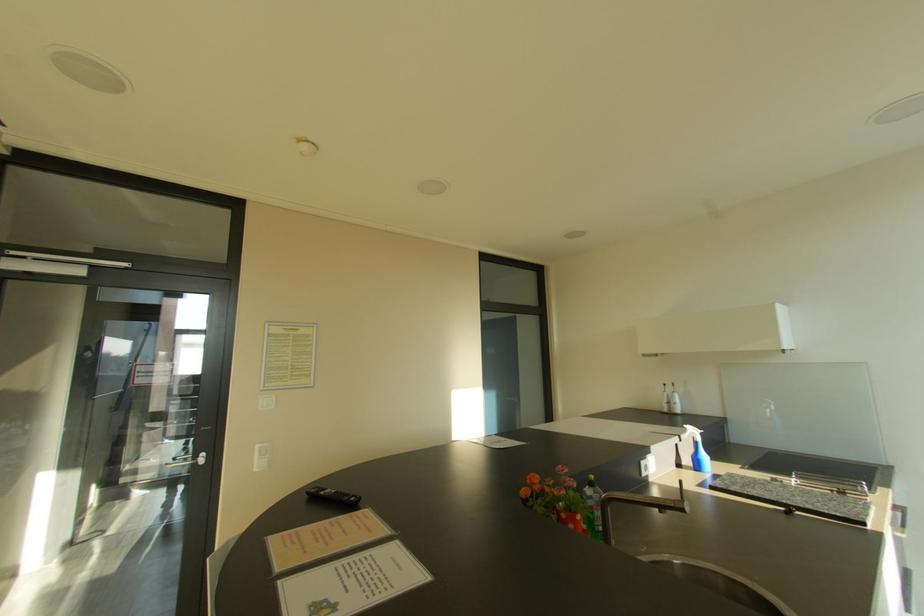
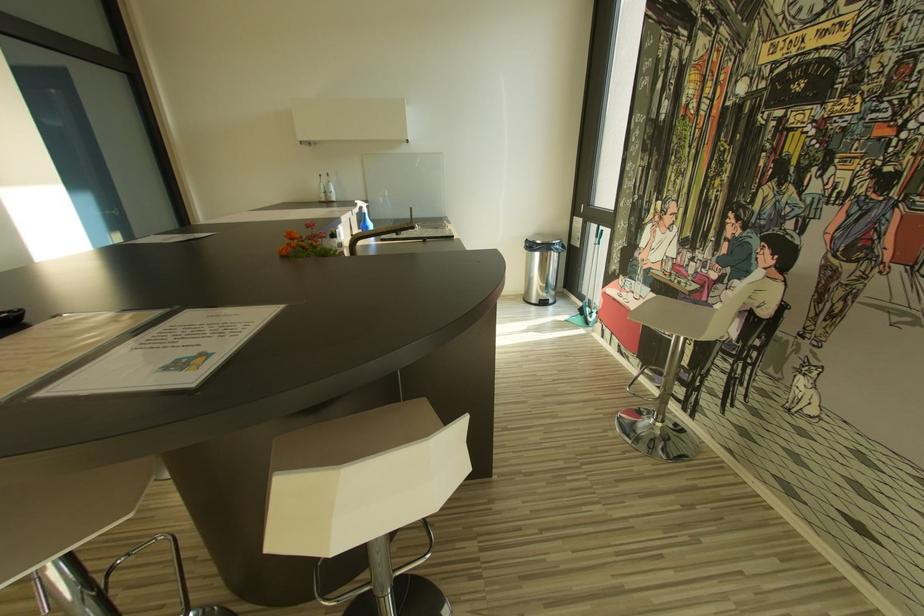
The first image is from the beginning of the video and the second image is from the end. How did the camera likely rotate when shooting the video?

The camera rotated toward right-down.